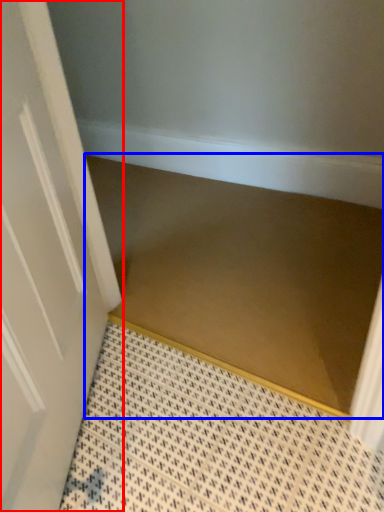
Question: Among these objects, which one is farthest to the camera, door (highlighted by a red box) or stair (highlighted by a blue box)?

Choices:
 (A) door
 (B) stair

Answer: (B)